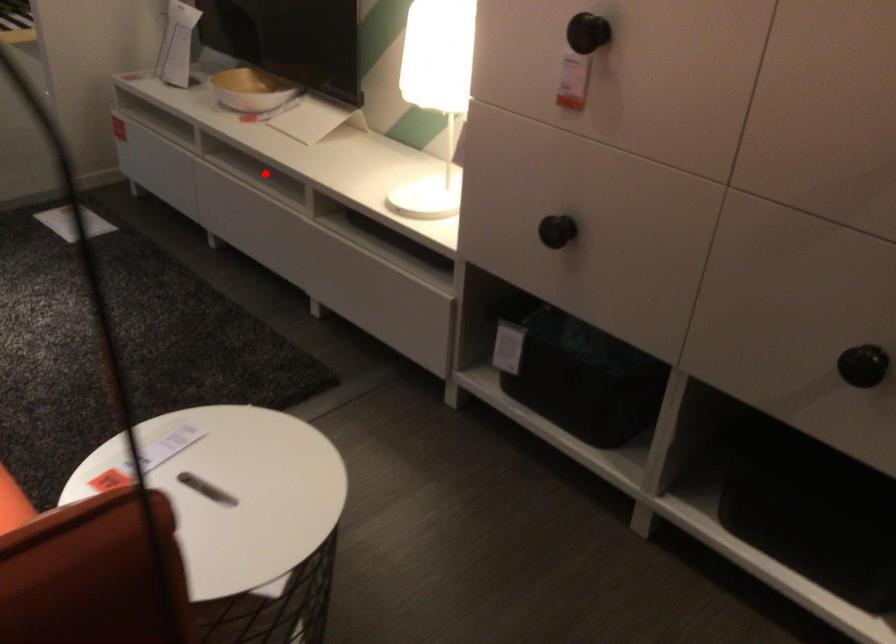
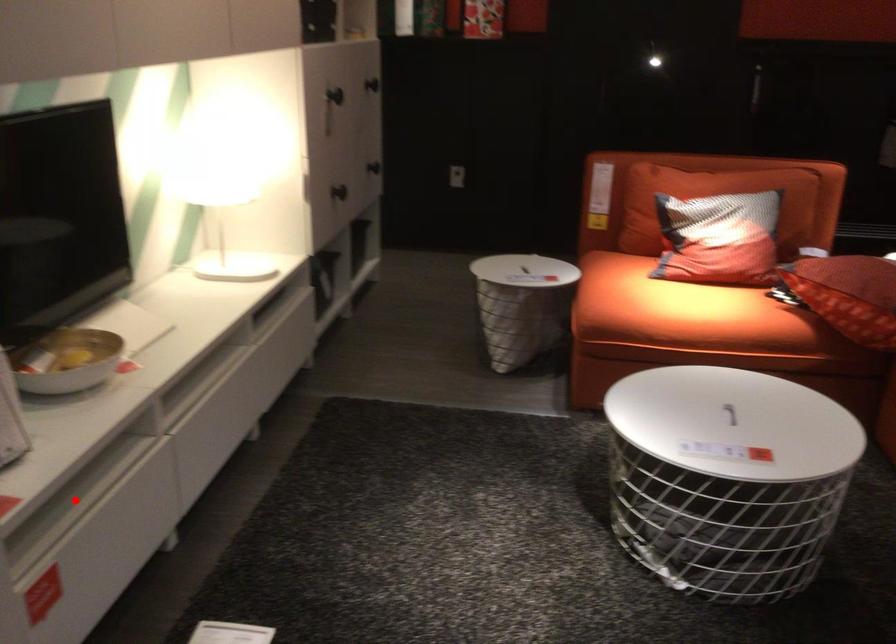
I am providing you with two images of the same scene from different viewpoints. A red point is marked on the first image and another point is marked on the second image. Is the red point in image1 aligned with the point shown in image2?

No